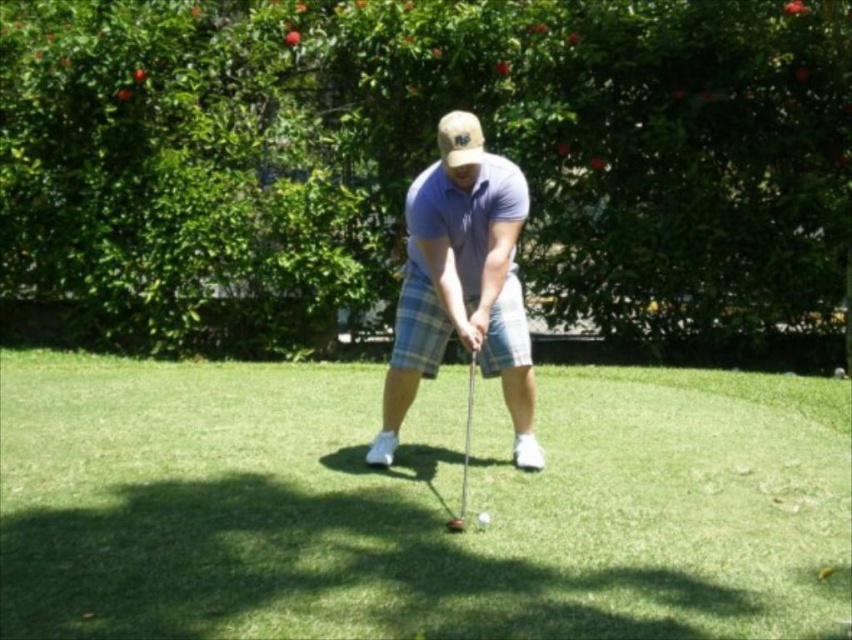
Question: Can you confirm if green grass at center is thinner than metallic silver golf club at center?

Choices:
 (A) yes
 (B) no

Answer: (B)

Question: Is green grass at center wider than matte blue shirt at center?

Choices:
 (A) no
 (B) yes

Answer: (A)

Question: Considering the relative positions of metallic silver golf club at center and shiny silver golf ball at center in the image provided, where is metallic silver golf club at center located with respect to shiny silver golf ball at center?

Choices:
 (A) right
 (B) left

Answer: (A)

Question: Which point is closer to the camera?

Choices:
 (A) metallic silver golf club at center
 (B) shiny silver golf ball at center
 (C) green grass at center

Answer: (C)

Question: Which point is farther from the camera taking this photo?

Choices:
 (A) (516, 387)
 (B) (467, 422)
 (C) (665, 513)

Answer: (B)

Question: Which of these objects is positioned closest to the matte blue shirt at center?

Choices:
 (A) green grass at center
 (B) metallic silver golf club at center
 (C) shiny silver golf ball at center

Answer: (C)